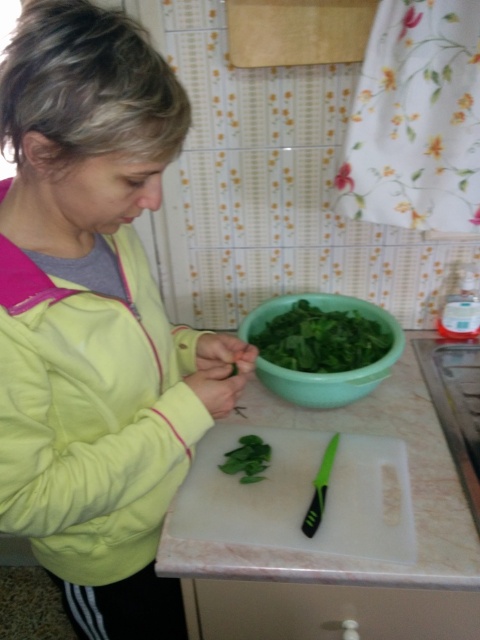
You are a chef preparing a dish and need to place a garnish on the green leafy vegetable at center. Where should you place the garnish relative to the white plastic cutting board at center?

The white plastic cutting board at center is in front of the green leafy vegetable at center, so you should place the garnish behind the white plastic cutting board at center to reach the green leafy vegetable at center.

You are a chef preparing a dish and need to determine if the green leafy vegetable at center will fit inside the green plastic bowl at center. Can you confirm if the vegetable will fit vertically?

The green plastic bowl at center has a greater height compared to green leafy vegetable at center, so the vegetable will fit vertically inside the bowl.

You are a chef observing someone in the kitchen. You notice the yellow fabric jacket at center and the green leafy vegetable at center. Which object is closer to you?

The yellow fabric jacket at center is closer to you because it is in front of the green leafy vegetable at center.